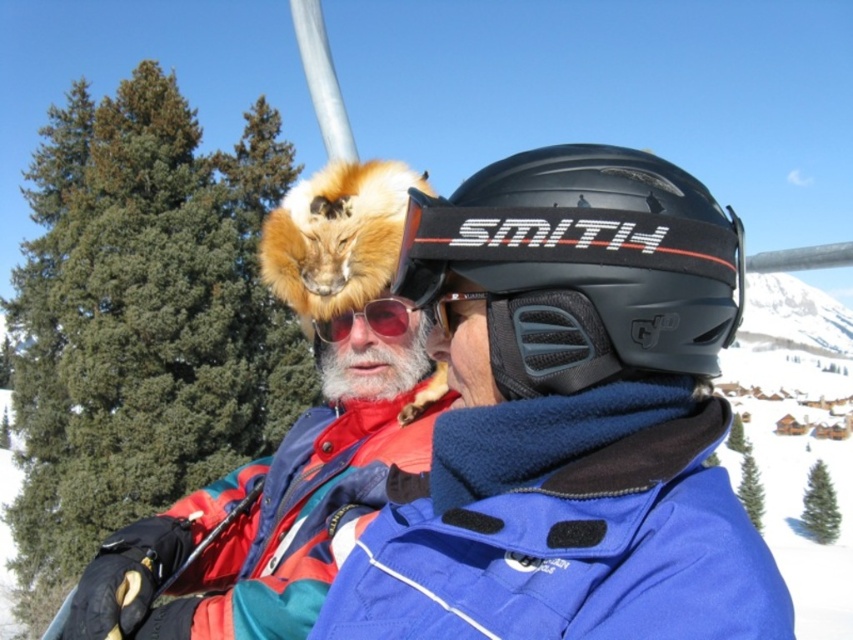
Between blue fleece jacket at center and matte black goggles at center, which one appears on the right side from the viewer's perspective?

Positioned to the right is blue fleece jacket at center.

Does blue fleece jacket at center have a lesser height compared to matte black goggles at center?

Incorrect, blue fleece jacket at center's height does not fall short of matte black goggles at center's.

Locate an element on the screen. This screenshot has width=853, height=640. blue fleece jacket at center is located at coordinates pyautogui.click(x=566, y=529).

Can you confirm if black matte helmet at center is wider than red reflective lens goggles at center?

Indeed, black matte helmet at center has a greater width compared to red reflective lens goggles at center.

Who is more distant from viewer, (582, 216) or (329, 333)?

Positioned behind is point (329, 333).

The image size is (853, 640). What do you see at coordinates (583, 266) in the screenshot? I see `black matte helmet at center` at bounding box center [583, 266].

Locate an element on the screen. Image resolution: width=853 pixels, height=640 pixels. black matte helmet at center is located at coordinates coord(583,266).

Does fuzzy fur hat at upper left have a lesser width compared to matte black goggles at center?

No.

Is fuzzy fur hat at upper left above matte black goggles at center?

Actually, fuzzy fur hat at upper left is below matte black goggles at center.

I want to click on fuzzy fur hat at upper left, so click(274, 508).

The width and height of the screenshot is (853, 640). In order to click on fuzzy fur hat at upper left in this screenshot , I will do `click(274, 508)`.